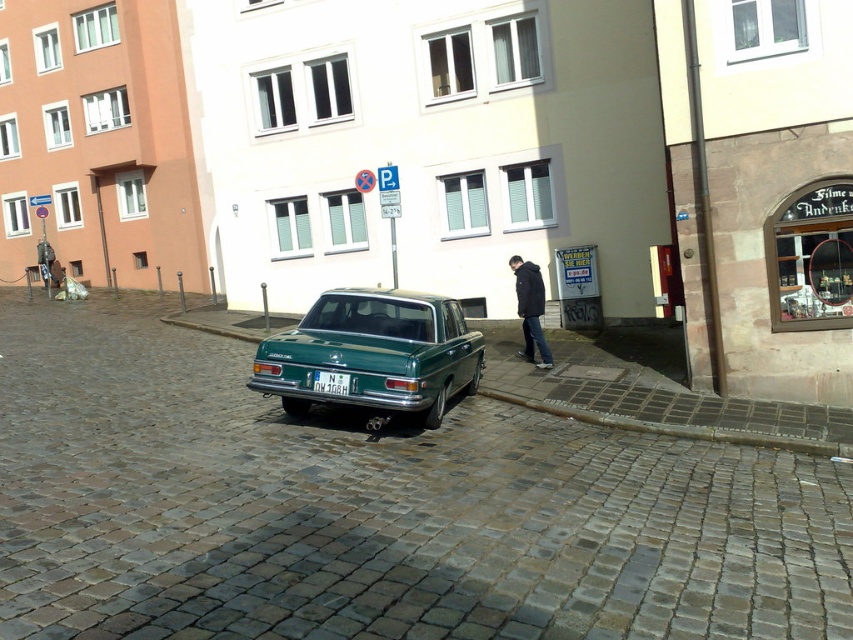
You are standing on the cobblestone road in the urban street scene. There is a point marked at coordinates (531, 308). What object is located at that point?

The point at coordinates (531, 308) corresponds to the black matte jacket at center.

You are a delivery person with a 1.5 meter wide cart. You need to navigate between the green metallic curb at lower center and the black matte jacket at center to reach the delivery point. Can your cart fit through the space between them?

The distance between the green metallic curb at lower center and the black matte jacket at center is 1.74 meters. Since your cart is 1.5 meters wide, it can fit through the space as there is enough clearance.